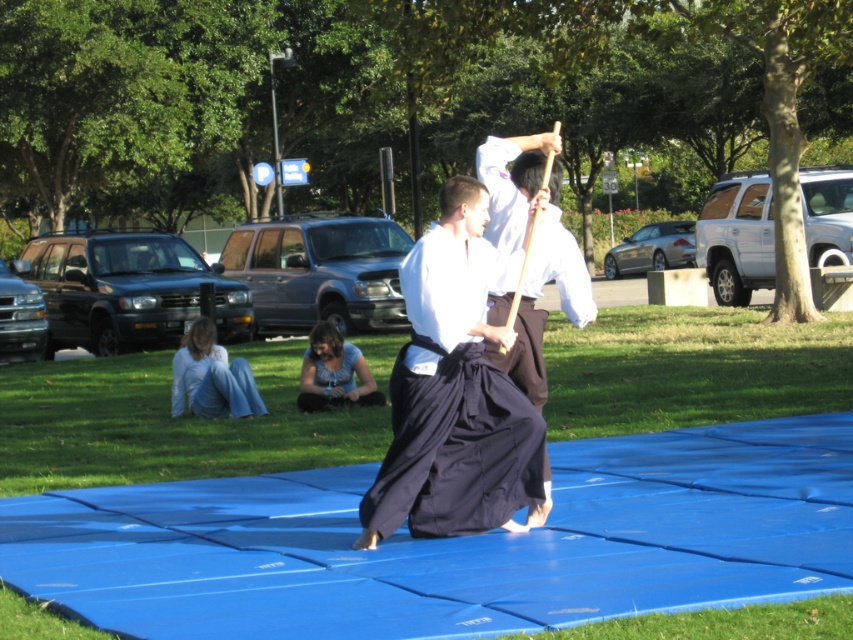
Is point (181, 410) less distant than point (343, 356)?

No, (181, 410) is behind (343, 356).

Is the position of light blue cotton pants at lower left less distant than that of blue denim jeans at lower center?

Yes, it is in front of blue denim jeans at lower center.

Which is behind, point (219, 417) or point (354, 349)?

The point (219, 417) is more distant.

Where is `light blue cotton pants at lower left`? The image size is (853, 640). light blue cotton pants at lower left is located at coordinates (213, 385).

Is black cotton kimono at center to the left of white cotton kimono at center from the viewer's perspective?

Indeed, black cotton kimono at center is positioned on the left side of white cotton kimono at center.

Can you confirm if black cotton kimono at center is shorter than white cotton kimono at center?

Yes, black cotton kimono at center is shorter than white cotton kimono at center.

What do you see at coordinates (451, 406) in the screenshot? The height and width of the screenshot is (640, 853). I see `black cotton kimono at center` at bounding box center [451, 406].

Where is `black cotton kimono at center`? The image size is (853, 640). black cotton kimono at center is located at coordinates (451, 406).

Which is more to the right, black cotton kimono at center or light blue cotton pants at lower left?

black cotton kimono at center

Which is below, black cotton kimono at center or light blue cotton pants at lower left?

Positioned lower is light blue cotton pants at lower left.

Between point (451, 326) and point (172, 401), which one is positioned in front?

Point (451, 326) is more forward.

I want to click on black cotton kimono at center, so click(451, 406).